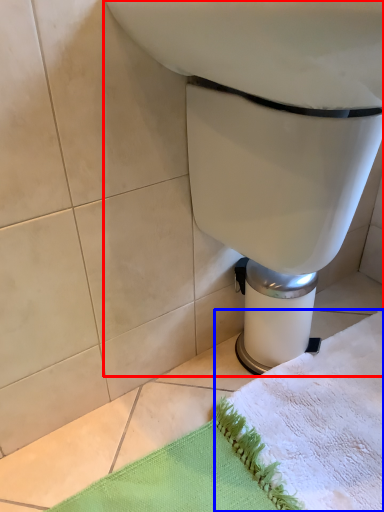
Question: Which point is further to the camera, toilet (highlighted by a red box) or bath towel (highlighted by a blue box)?

Choices:
 (A) toilet
 (B) bath towel

Answer: (B)